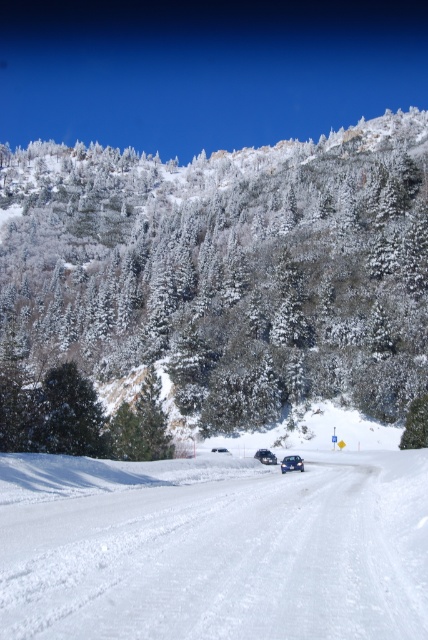
Looking at this image, does green matte tree at upper center have a lesser width compared to white snow ski slope at center?

Incorrect, green matte tree at upper center's width is not less than white snow ski slope at center's.

Between green matte tree at upper center and white snow ski slope at center, which one has less height?

With less height is white snow ski slope at center.

Is point (193, 275) behind point (350, 468)?

Yes.

Locate an element on the screen. The image size is (428, 640). green matte tree at upper center is located at coordinates (228, 269).